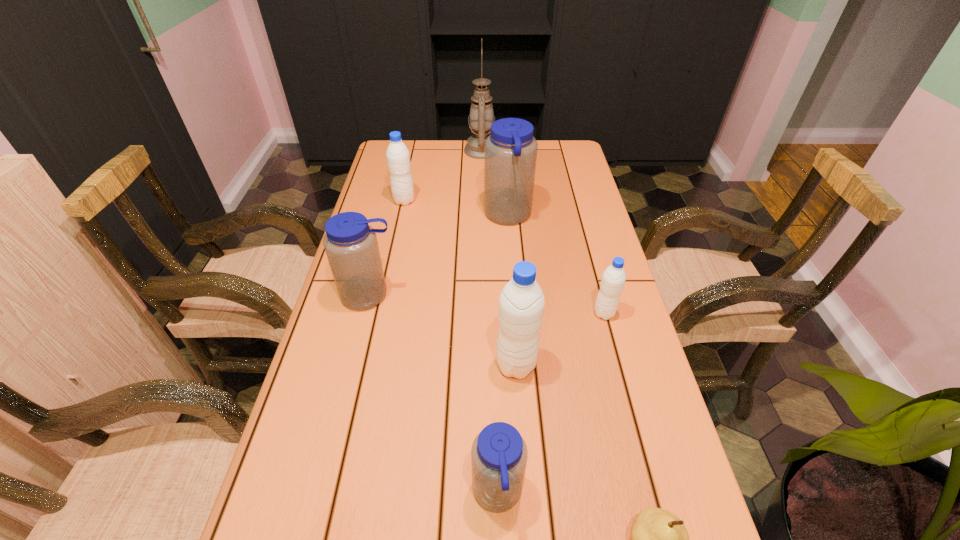
Identify which water bottle is located as the second nearest to the second smallest blue water bottle. Please provide its 2D coordinates. Your answer should be formatted as a tuple, i.e. [(x, y)], where the tuple contains the x and y coordinates of a point satisfying the conditions above.

[(510, 153)]

The width and height of the screenshot is (960, 540). I want to click on the second closest gray water bottle relative to the second nearest blue water bottle, so coord(398,157).

Select which gray water bottle appears as the closest to the rightmost water bottle. Please provide its 2D coordinates. Your answer should be formatted as a tuple, i.e. [(x, y)], where the tuple contains the x and y coordinates of a point satisfying the conditions above.

[(521, 303)]

Locate an element on the screen. the third closest blue water bottle relative to the fifth farthest water bottle is located at coordinates (510, 153).

The image size is (960, 540). In order to click on blue water bottle that stands as the second closest to the biggest blue water bottle in this screenshot , I will do [x=499, y=454].

Locate an element on the screen. This screenshot has width=960, height=540. vacant position in the image that satisfies the following two spatial constraints: 1. with a carrying loop on the side of the leftmost blue water bottle; 2. on the left side of the biggest gray water bottle is located at coordinates (352, 365).